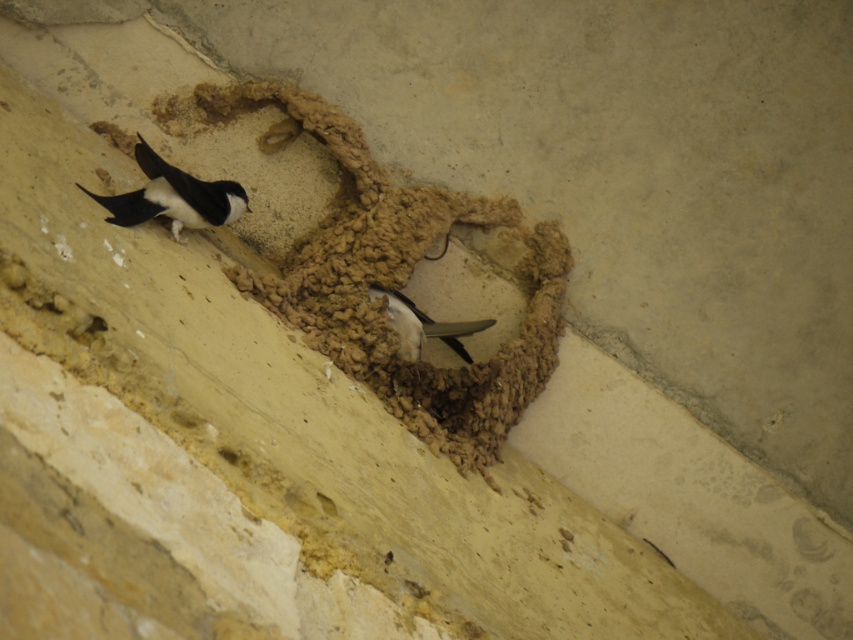
Question: In this image, where is black glossy swallow at upper left located relative to white glossy bird at center?

Choices:
 (A) left
 (B) right

Answer: (A)

Question: Is black glossy swallow at upper left bigger than white glossy bird at center?

Choices:
 (A) yes
 (B) no

Answer: (A)

Question: Can you confirm if black glossy swallow at upper left is bigger than white glossy bird at center?

Choices:
 (A) yes
 (B) no

Answer: (A)